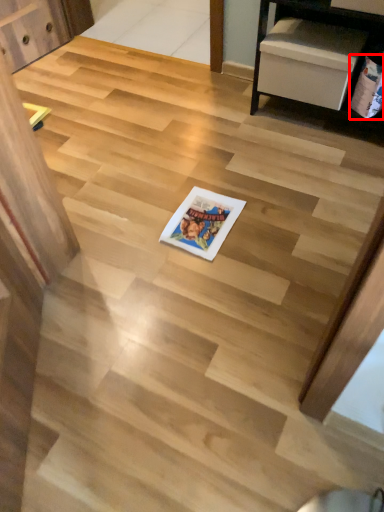
Question: From the image, what is the correct spatial relationship of comic book (annotated by the red box) in relation to comic book?

Choices:
 (A) left
 (B) right

Answer: (B)